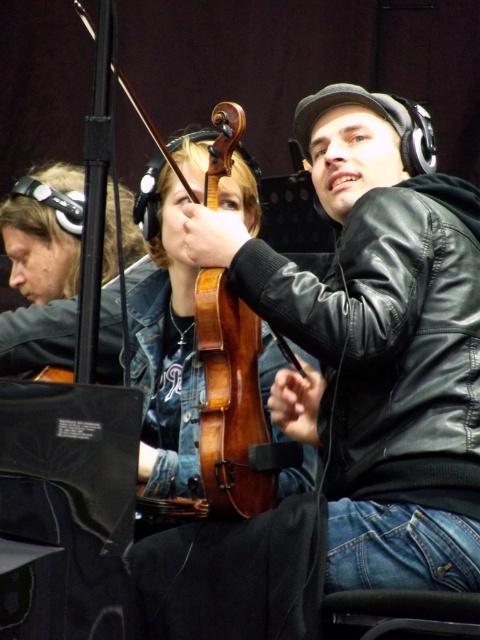
You are a photographer setting up for a music session. You need to position a spotlight so it illuminates both the black leather jacket at center and the wooden violin at center. Given their positions, which object should the spotlight be placed to the left of to ensure both are lit?

The spotlight should be placed to the left of the black leather jacket at center because the black leather jacket at center is to the right of the wooden violin at center, so positioning it to the left of the jacket will cover both objects.